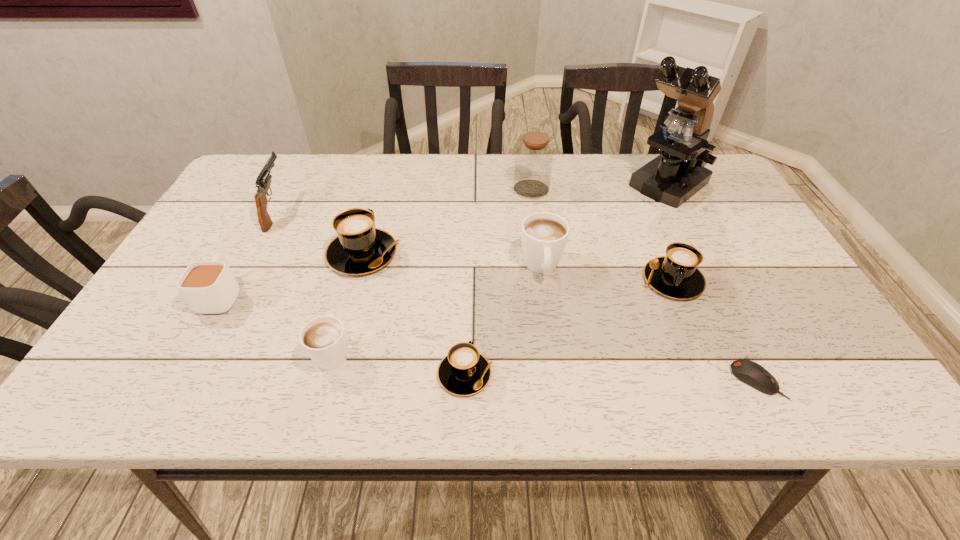
This screenshot has width=960, height=540. What are the coordinates of `object that is at the far right corner` in the screenshot? It's located at (679, 172).

At what (x,y) coordinates should I click in order to perform the action: click on object present at the near right corner. Please return your answer as a coordinate pair (x, y). Image resolution: width=960 pixels, height=540 pixels. Looking at the image, I should click on (749, 372).

Image resolution: width=960 pixels, height=540 pixels. In the image, there is a desktop. Identify the location of free space at the far edge. (380, 156).

Where is `free spot at the near edge of the desktop`? The height and width of the screenshot is (540, 960). free spot at the near edge of the desktop is located at coordinates (587, 402).

In the image, there is a desktop. Identify the location of blank space at the right edge. (718, 211).

The height and width of the screenshot is (540, 960). In the image, there is a desktop. Identify the location of vacant space at the far left corner. pyautogui.click(x=252, y=193).

The height and width of the screenshot is (540, 960). Find the location of `vacant space at the near left corner`. vacant space at the near left corner is located at coordinates (180, 373).

I want to click on free space at the near right corner of the desktop, so click(x=819, y=391).

At what (x,y) coordinates should I click in order to perform the action: click on free space between the white cup and the gun. Please return your answer as a coordinate pair (x, y). Looking at the image, I should click on (250, 252).

Where is `vacant area between the third cappuccino from left to right and the second biggest black cappuccino`? vacant area between the third cappuccino from left to right and the second biggest black cappuccino is located at coordinates (568, 327).